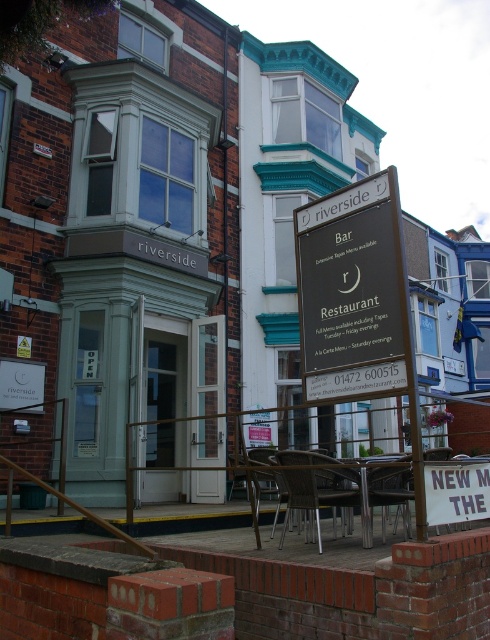
You are standing in front of the riverside establishment and want to place the black signboard at center on top of the metallic silver chair at center. Will the signboard fit on the chair?

The black signboard at center has a lesser width compared to metallic silver chair at center, so the signboard will fit on the chair.